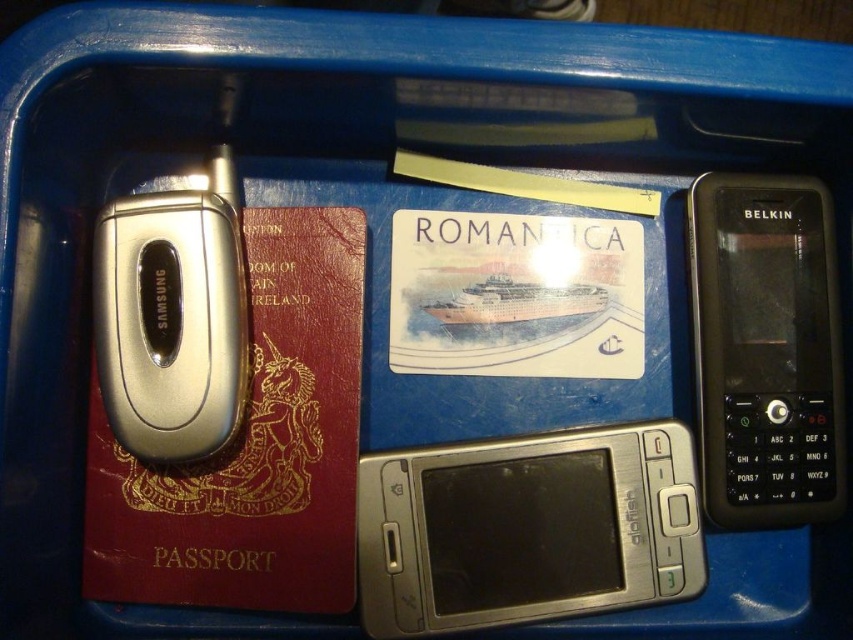
Does silver metallic smartphone at center appear over silver metallic samsung phone at left?

Incorrect, silver metallic smartphone at center is not positioned above silver metallic samsung phone at left.

This screenshot has width=853, height=640. Find the location of `silver metallic smartphone at center`. silver metallic smartphone at center is located at coordinates (526, 529).

Who is more forward, (585, 493) or (132, 289)?

Point (132, 289)

Image resolution: width=853 pixels, height=640 pixels. Identify the location of silver metallic smartphone at center. (526, 529).

Does silver metallic smartphone at center appear on the left side of black plastic phone at right?

Indeed, silver metallic smartphone at center is positioned on the left side of black plastic phone at right.

I want to click on silver metallic smartphone at center, so click(526, 529).

You are a GUI agent. You are given a task and a screenshot of the screen. Output one action in this format:
    pyautogui.click(x=<x>, y=<y>)
    Task: Click on the silver metallic smartphone at center
    This screenshot has width=853, height=640.
    Given the screenshot: What is the action you would take?
    pyautogui.click(x=526, y=529)

Does black plastic phone at right come behind silver metallic samsung phone at left?

Yes.

Which is behind, point (787, 513) or point (157, 451)?

The point (787, 513) is behind.

Find the location of a particular element. black plastic phone at right is located at coordinates (766, 349).

I want to click on black plastic phone at right, so click(766, 349).